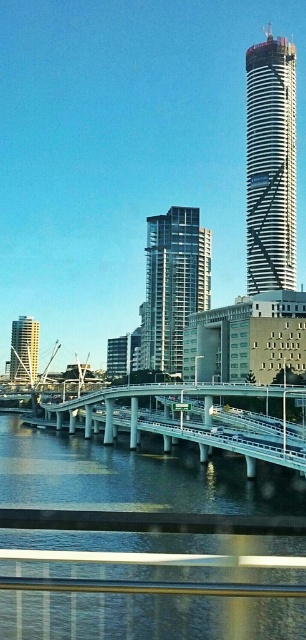
You are a city planner analyzing the urban layout. Based on the image, which object is positioned higher in the scene between the clear water at bridge lower and the matte glass skyscraper at left?

The clear water at bridge lower is located above the matte glass skyscraper at left, so it is positioned higher in the scene.